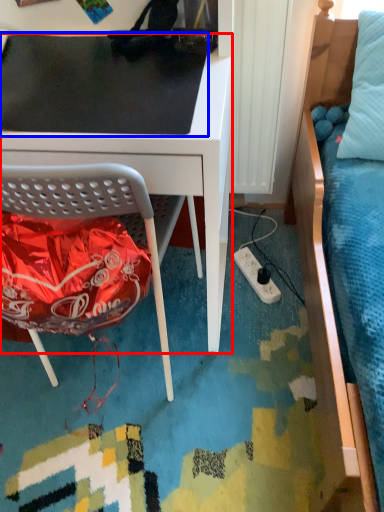
Question: Which point is further to the camera, desk (highlighted by a red box) or table top (highlighted by a blue box)?

Choices:
 (A) desk
 (B) table top

Answer: (B)